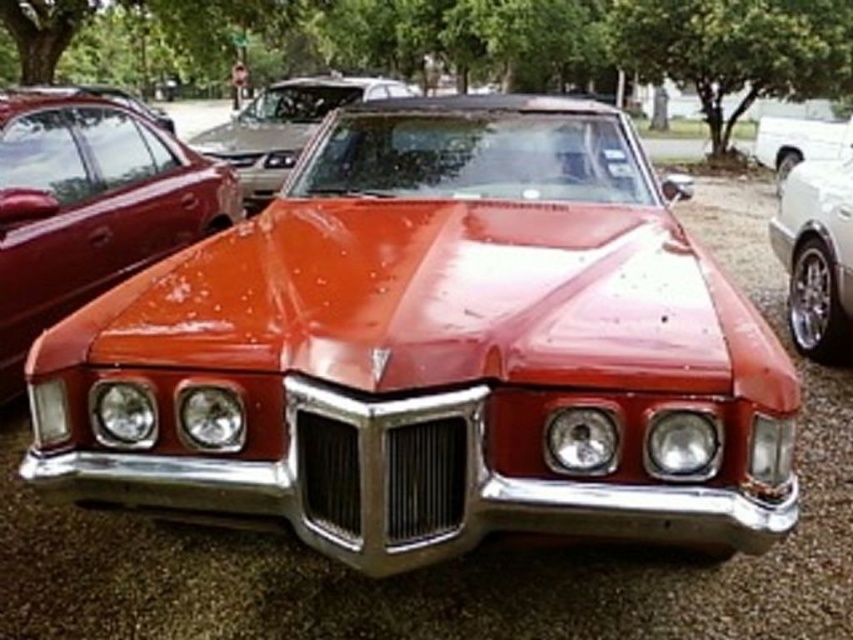
You are a photographer trying to capture the shiny metallic car at center and the shiny white truck at right. Which vehicle should you focus on if you want to photograph the one that is closer to the left side of the frame?

The shiny metallic car at center is positioned on the left side of the shiny white truck at right, so it is closer to the left side of the frame.

You are standing in the parking area and want to take a photo of the shiny metallic car at center. Based on its position relative to other objects, where should you position yourself to ensure it is centered in your camera frame?

The shiny metallic car at center is located at point coordinates, so positioning yourself directly in front of it at the center point would ensure it is centered in your camera frame.

You are a photographer trying to capture the glossy red car at center and the glossy metallic car at right in a single shot. Based on their positions, which car should you focus on first if you want to ensure both are in sharp focus?

The glossy metallic car at right is below the glossy red car at center, so you should focus on the glossy red car at center first because it is closer to the camera, ensuring both will be in focus when using depth of field properly.